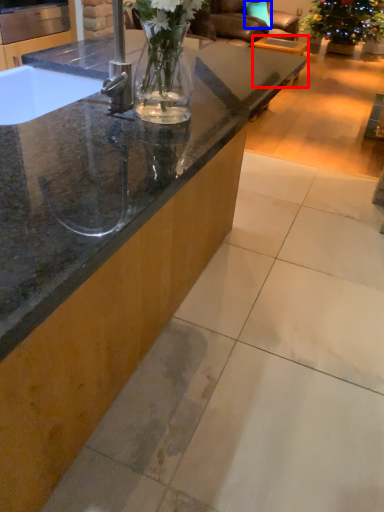
Question: Which of the following is the closest to the observer, table (highlighted by a red box) or pillow (highlighted by a blue box)?

Choices:
 (A) table
 (B) pillow

Answer: (A)